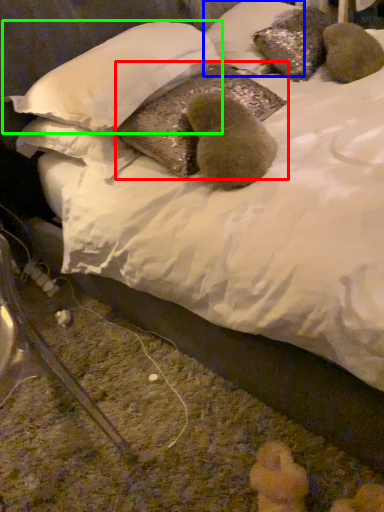
Question: Which object is the closest to the pillow (highlighted by a red box)? Choose among these: pillow (highlighted by a blue box) or pillow (highlighted by a green box).

Choices:
 (A) pillow
 (B) pillow

Answer: (B)